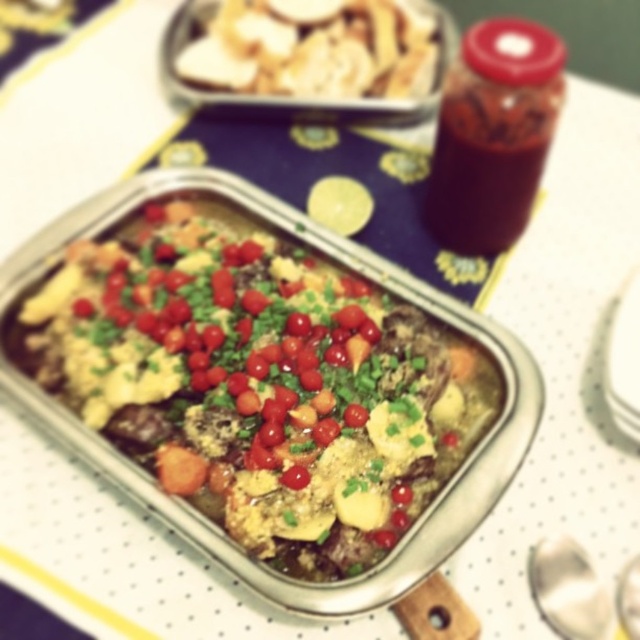
Question: Does slightly browned baked dish at center lie in front of white crumbly at upper center?

Choices:
 (A) no
 (B) yes

Answer: (B)

Question: Does slightly browned baked dish at center have a lesser width compared to white crumbly at upper center?

Choices:
 (A) yes
 (B) no

Answer: (B)

Question: Which point is closer to the camera?

Choices:
 (A) (305, 44)
 (B) (260, 397)

Answer: (B)

Question: Does slightly browned baked dish at center come behind white crumbly at upper center?

Choices:
 (A) no
 (B) yes

Answer: (A)